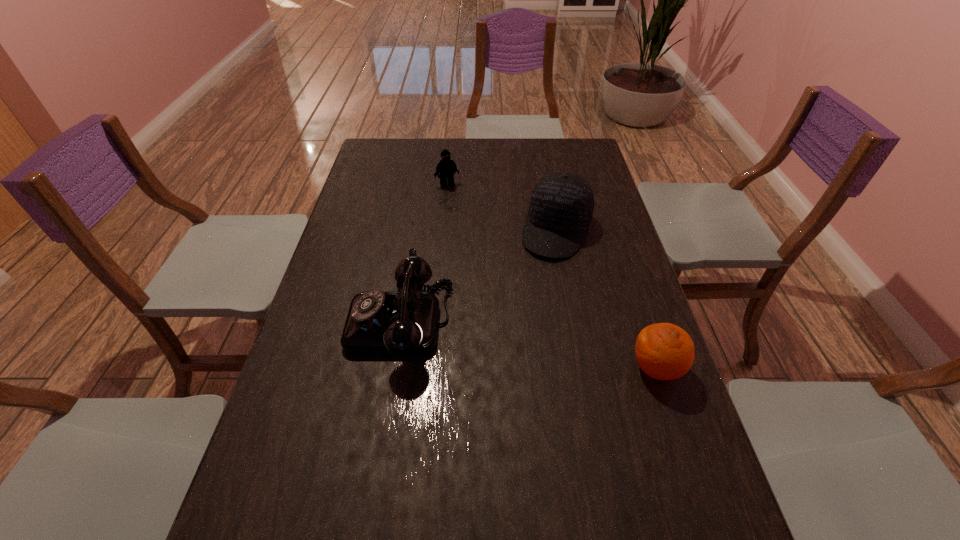
You are a GUI agent. You are given a task and a screenshot of the screen. Output one action in this format:
    pyautogui.click(x=<x>, y=<y>)
    Task: Click on the telephone
    The height and width of the screenshot is (540, 960).
    Given the screenshot: What is the action you would take?
    pyautogui.click(x=405, y=323)

Locate an element on the screen. The height and width of the screenshot is (540, 960). orange is located at coordinates (664, 351).

Find the location of a particular element. Lego is located at coordinates (446, 167).

This screenshot has height=540, width=960. I want to click on baseball cap, so pos(561,206).

Identify the location of vacant region located 0.100m on the dial of the telephone. (311, 322).

Where is `free space located 0.060m on the dial of the telephone`? free space located 0.060m on the dial of the telephone is located at coordinates (326, 322).

Locate an element on the screen. vacant space situated 0.270m on the back of the orange is located at coordinates (624, 271).

Find the location of a particular element. Image resolution: width=960 pixels, height=540 pixels. vacant region located on the face of the farthest object is located at coordinates (480, 239).

Locate an element on the screen. This screenshot has height=540, width=960. free point located on the face of the farthest object is located at coordinates (478, 235).

Locate an element on the screen. The image size is (960, 540). vacant space positioned 0.200m on the face of the farthest object is located at coordinates (469, 220).